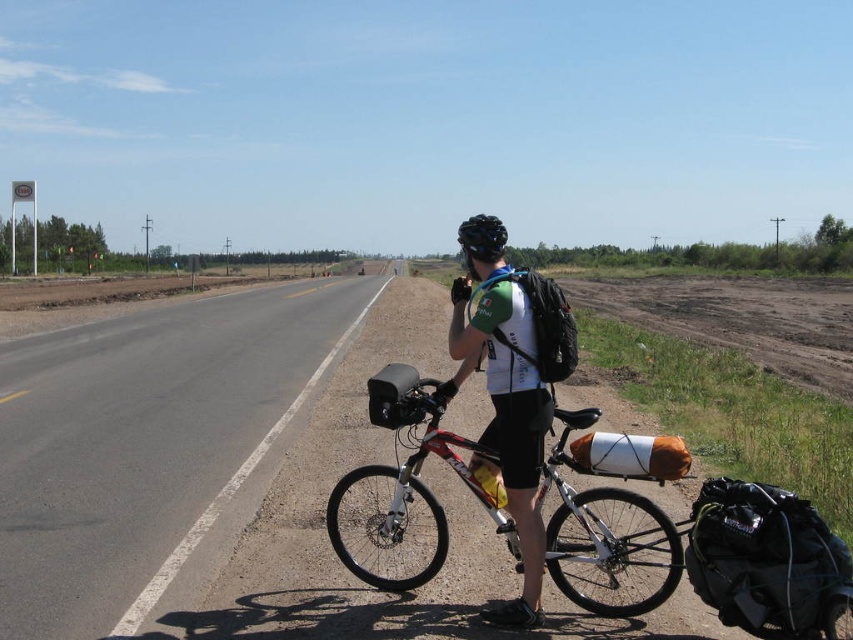
You are a pedestrian standing at the edge of the asphalt road at left. You want to walk to the black matte bicycle helmet at center. Is the helmet closer to you or farther away?

The asphalt road at left is closer to the viewer than black matte bicycle helmet at center, so the helmet is farther away from you.

You are a pedestrian standing on the side of the road. You see the asphalt road at left and the black matte bicycle helmet at center. Which object is closer to your right side?

The black matte bicycle helmet at center is closer to your right side because the asphalt road at left is positioned to its left, meaning the helmet is to the right of the road.

You are a drone operator flying a drone that has a maximum flight radius of 10 meters. You are currently hovering above the asphalt road at left and want to capture a photo of the black matte bicycle helmet at center. Can your drone reach the helmet from your current position?

The asphalt road at left and black matte bicycle helmet at center are 12.72 meters apart from each other. Since the drone has a maximum flight radius of 10 meters, it cannot reach the helmet as the distance exceeds its limit.